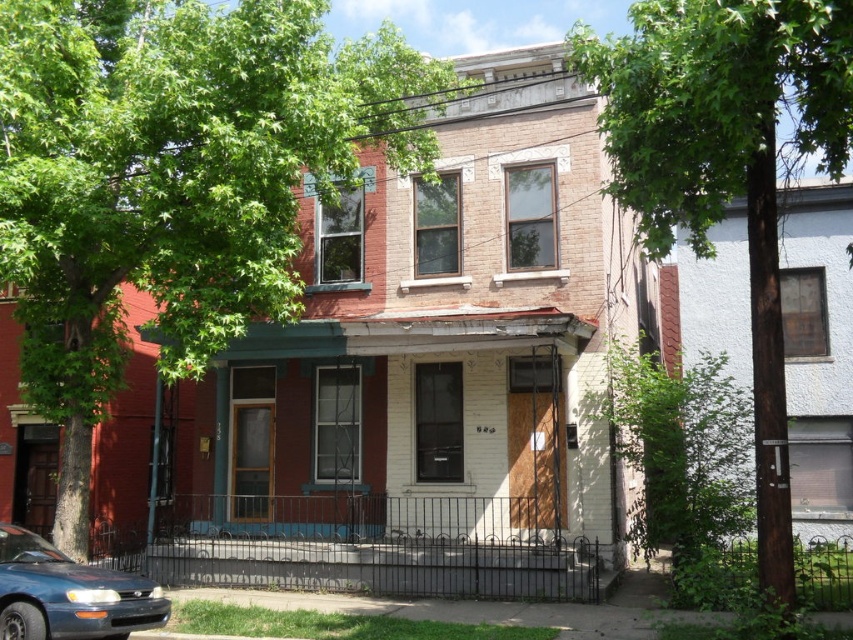
Question: Does green leafy tree at upper left have a larger size compared to green leafy tree at center?

Choices:
 (A) no
 (B) yes

Answer: (A)

Question: Does green leafy tree at upper left have a lesser width compared to matte blue sedan at lower left?

Choices:
 (A) yes
 (B) no

Answer: (A)

Question: Which object appears closest to the camera in this image?

Choices:
 (A) green leafy tree at upper left
 (B) green leafy tree at center

Answer: (B)

Question: Which object is closer to the camera taking this photo?

Choices:
 (A) matte blue sedan at lower left
 (B) green leafy tree at upper left

Answer: (A)

Question: Among these objects, which one is farthest from the camera?

Choices:
 (A) matte blue sedan at lower left
 (B) green leafy tree at upper left
 (C) green leafy tree at center

Answer: (B)

Question: Is green leafy tree at upper left above matte blue sedan at lower left?

Choices:
 (A) yes
 (B) no

Answer: (A)